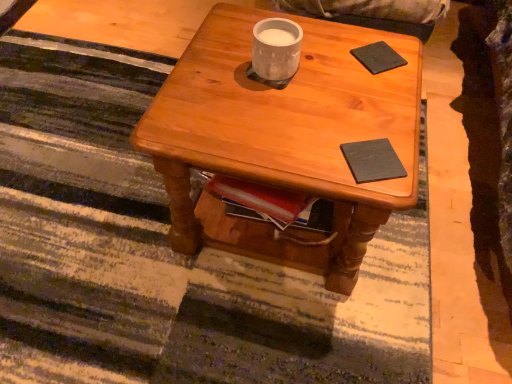
Where is `free space that is to the left of white matte cup at center`? free space that is to the left of white matte cup at center is located at coordinates (198, 87).